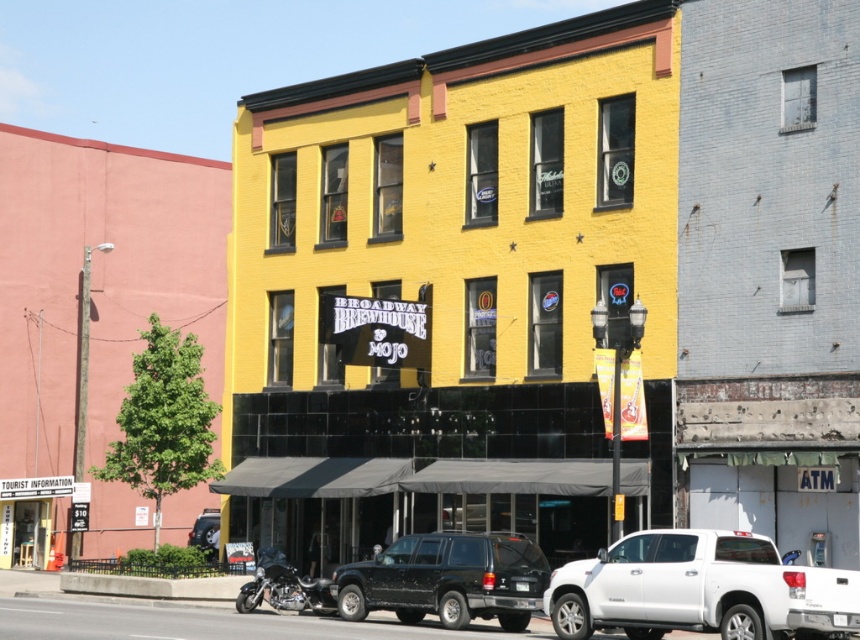
Where is `black matte suv at center`? The image size is (860, 640). black matte suv at center is located at coordinates (447, 579).

In order to click on black matte suv at center in this screenshot , I will do `click(447, 579)`.

In order to click on white matte pickup truck at lower right in this screenshot , I will do `click(699, 589)`.

Which is below, white matte pickup truck at lower right or metallic silver motorcycle at lower left?

Positioned lower is metallic silver motorcycle at lower left.

What do you see at coordinates (699, 589) in the screenshot?
I see `white matte pickup truck at lower right` at bounding box center [699, 589].

Where is `white matte pickup truck at lower right`? The width and height of the screenshot is (860, 640). white matte pickup truck at lower right is located at coordinates (699, 589).

Between shiny chrome motorcycle at lower left and metallic silver motorcycle at lower left, which one appears on the left side from the viewer's perspective?

metallic silver motorcycle at lower left

Is shiny chrome motorcycle at lower left taller than metallic silver motorcycle at lower left?

No, shiny chrome motorcycle at lower left is not taller than metallic silver motorcycle at lower left.

Where is `shiny chrome motorcycle at lower left`? The height and width of the screenshot is (640, 860). shiny chrome motorcycle at lower left is located at coordinates (x=283, y=588).

Where is `shiny chrome motorcycle at lower left`? shiny chrome motorcycle at lower left is located at coordinates (283, 588).